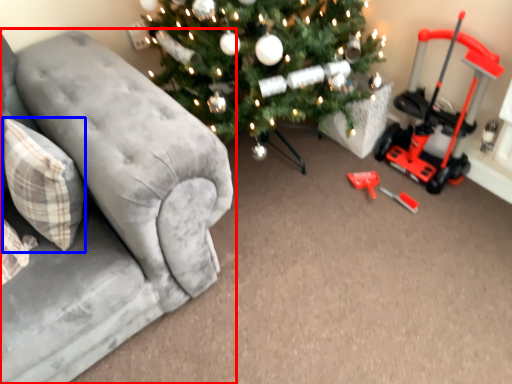
Question: Among these objects, which one is nearest to the camera, studio couch (highlighted by a red box) or pillow (highlighted by a blue box)?

Choices:
 (A) studio couch
 (B) pillow

Answer: (A)